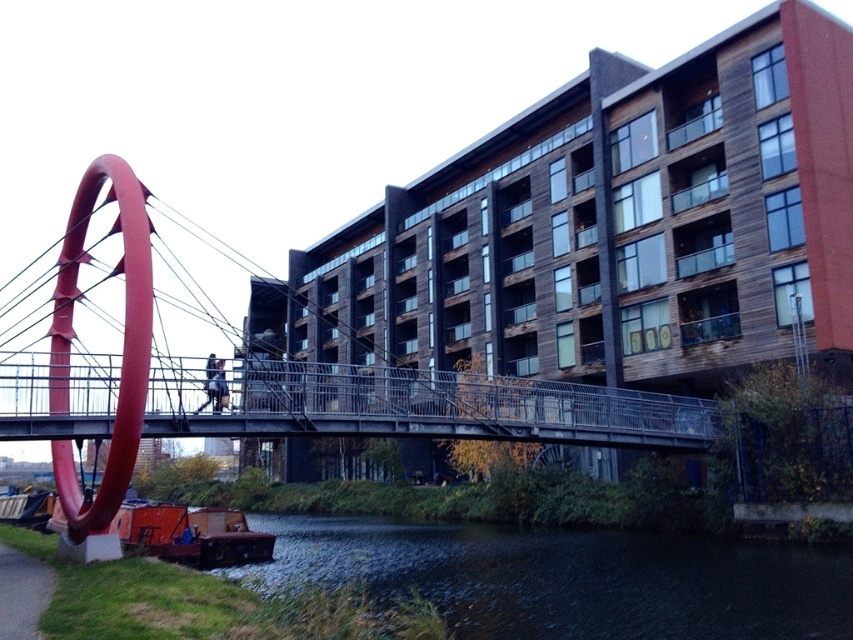
Question: Which is nearer to the metallic gray bridge at center?

Choices:
 (A) dark water at lower left
 (B) green grass at lower left

Answer: (A)

Question: Can you confirm if dark water at lower left is thinner than metallic gray bridge at center?

Choices:
 (A) yes
 (B) no

Answer: (A)

Question: Which point is farther to the camera?

Choices:
 (A) (451, 376)
 (B) (405, 586)

Answer: (A)

Question: Is dark water at lower left to the right of metallic gray bridge at center from the viewer's perspective?

Choices:
 (A) yes
 (B) no

Answer: (A)

Question: Is dark water at lower left closer to the viewer compared to green grass at lower left?

Choices:
 (A) yes
 (B) no

Answer: (B)

Question: Which of these objects is positioned farthest from the metallic gray bridge at center?

Choices:
 (A) dark water at lower left
 (B) green grass at lower left

Answer: (B)